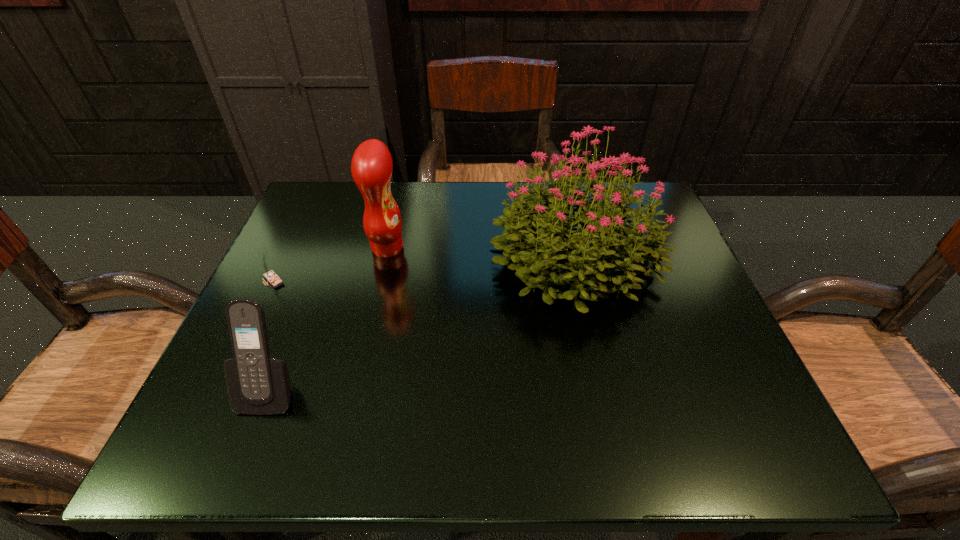
The height and width of the screenshot is (540, 960). What are the coordinates of `the tallest object` in the screenshot? It's located at (536, 239).

This screenshot has width=960, height=540. I want to click on bouquet, so click(x=536, y=239).

Find the location of a particular element. condiment is located at coordinates (371, 167).

Image resolution: width=960 pixels, height=540 pixels. I want to click on the third object from left to right, so click(371, 167).

Identify the location of the third tallest object. This screenshot has width=960, height=540. (257, 384).

Locate an element on the screen. Image resolution: width=960 pixels, height=540 pixels. the nearest object is located at coordinates (257, 384).

What are the coordinates of `the shortest object` in the screenshot? It's located at (269, 275).

Where is `matchbox`? matchbox is located at coordinates (269, 275).

Locate an element on the screen. This screenshot has height=540, width=960. vacant space situated on the front of the bouquet is located at coordinates (599, 354).

Where is `blank area located on the label side of the third object from left to right`? Image resolution: width=960 pixels, height=540 pixels. blank area located on the label side of the third object from left to right is located at coordinates (511, 247).